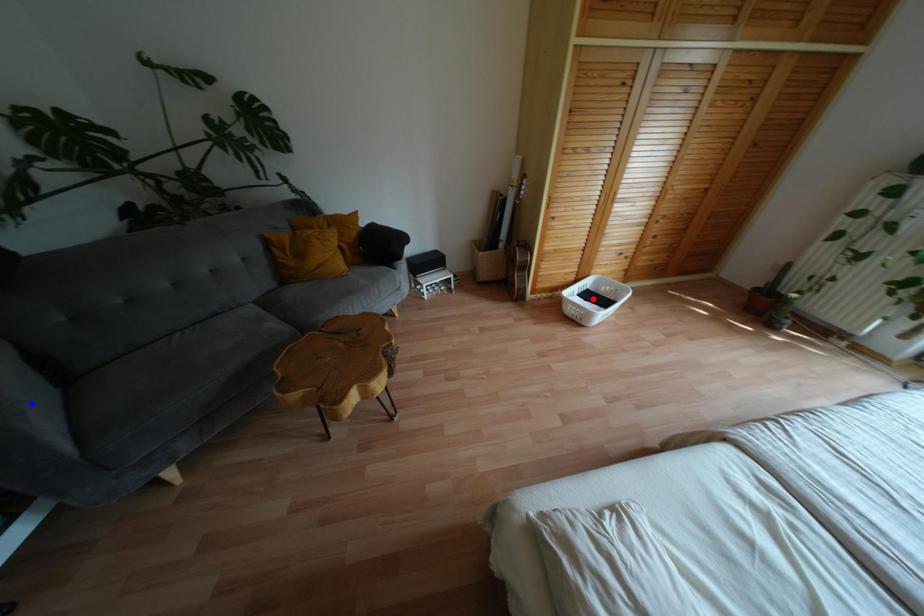
Question: Which of the two points in the image is closer to the camera?

Choices:
 (A) Blue point is closer.
 (B) Red point is closer.

Answer: (A)